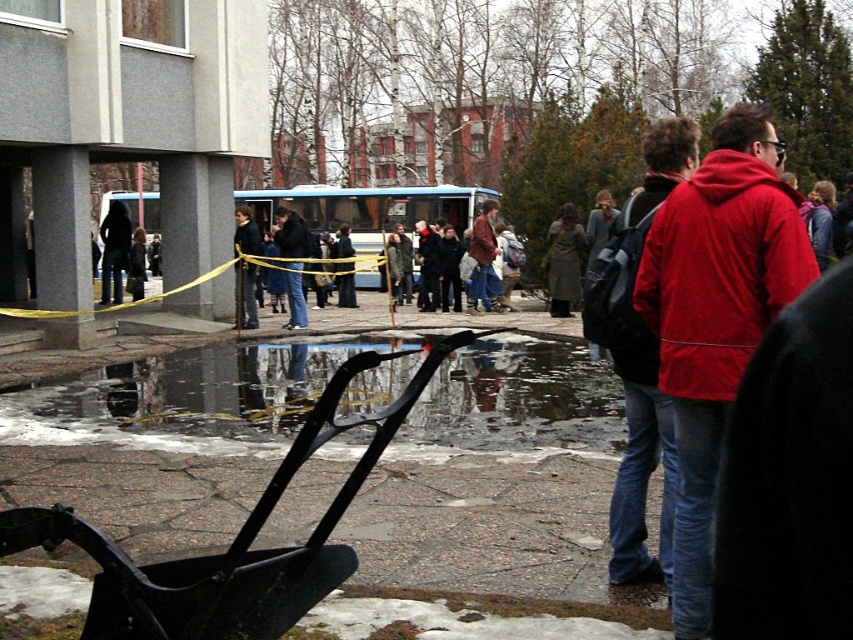
You are a delivery person trying to place a package between the black plastic baby carriage at lower center and the jeans at center. Can you fit the package there if it requires a space that is at least 1 meter wide?

The black plastic baby carriage at lower center is larger in size than jeans at center. However, without specific measurements of the space between them, it is impossible to determine if the package will fit. Please check the actual distance between the black plastic baby carriage at lower center and the jeans at center.

You are a parent carrying a black plastic baby carriage at lower center and need to cross the black rubber water at lower center. Can you safely walk through the water without the carriage getting submerged?

The black rubber water at lower center is thinner than the black plastic baby carriage at lower center, so the water is not deep enough to submerge the carriage. You can safely walk through the water with the carriage.

You are a delivery person trying to avoid stepping on the puddle. You see the red matte jacket at center and the black plastic baby carriage at lower center. Which object is closer to the edge of the puddle?

The red matte jacket at center is taller than the black plastic baby carriage at lower center, but this does not indicate their proximity to the puddle edge. Without specific spatial details about their positions relative to the puddle, I cannot determine which is closer.